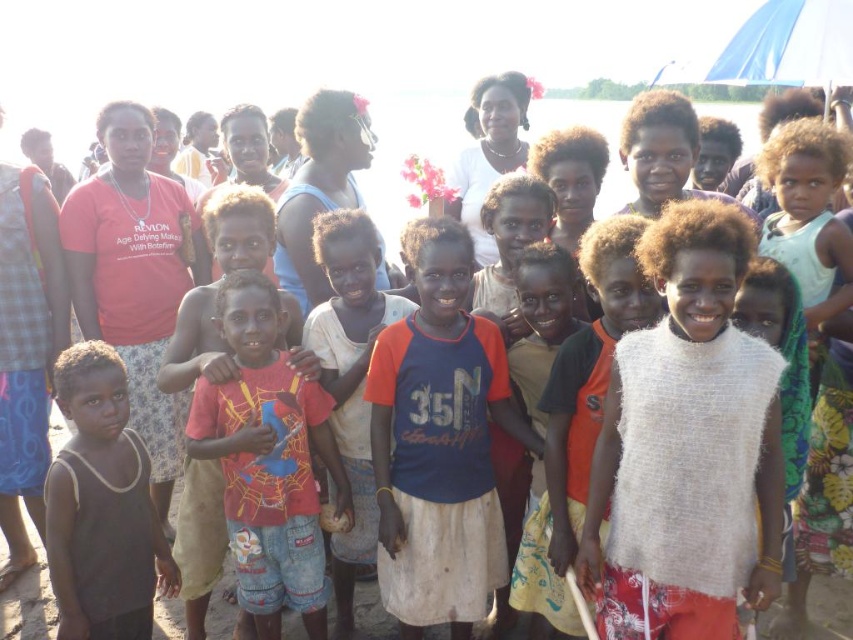
Question: Is white fuzzy vest at center below red t-shirt at center?

Choices:
 (A) yes
 (B) no

Answer: (B)

Question: Which of the following is the farthest from the observer?

Choices:
 (A) dark gray sleeveless shirt at lower left
 (B) white fuzzy vest at center

Answer: (A)

Question: Which point is closer to the camera taking this photo?

Choices:
 (A) (669, 387)
 (B) (488, 500)
 (C) (90, 348)

Answer: (A)

Question: Where is blue fabric shirt at center located in relation to dark gray sleeveless shirt at lower left in the image?

Choices:
 (A) below
 (B) above

Answer: (B)

Question: Is white fuzzy vest at center positioned behind red t-shirt at center?

Choices:
 (A) no
 (B) yes

Answer: (A)

Question: Among these objects, which one is nearest to the camera?

Choices:
 (A) red t-shirt at center
 (B) blue fabric shirt at center
 (C) dark gray sleeveless shirt at lower left

Answer: (C)